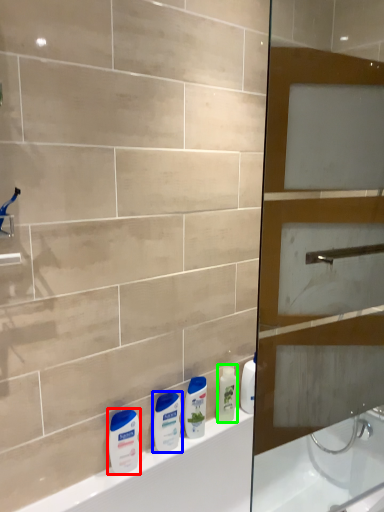
Question: Which object is positioned farthest from toiletry (highlighted by a red box)? Select from toiletry (highlighted by a blue box) and toiletry (highlighted by a green box).

Choices:
 (A) toiletry
 (B) toiletry

Answer: (B)